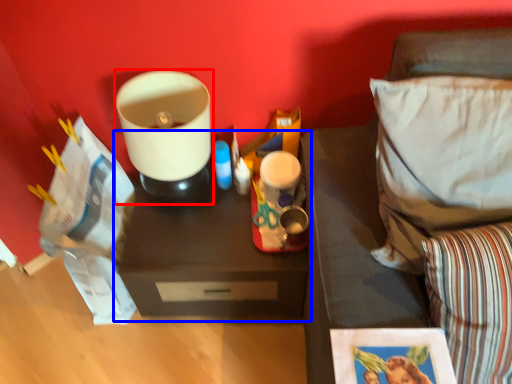
Question: Which point is closer to the camera, appliance (highlighted by a red box) or table (highlighted by a blue box)?

Choices:
 (A) appliance
 (B) table

Answer: (A)